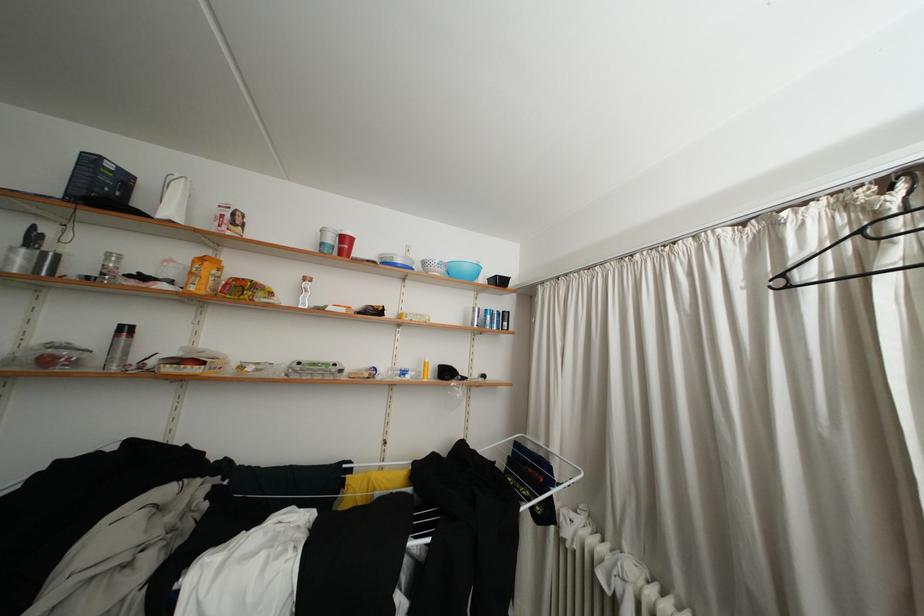
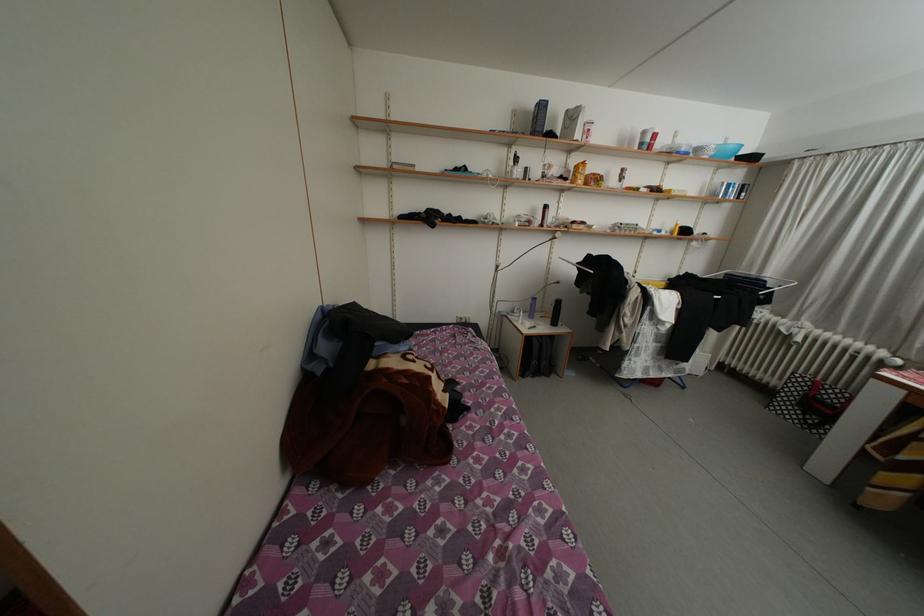
The point at (330,249) is marked in the first image. Where is the corresponding point in the second image?

(650, 148)